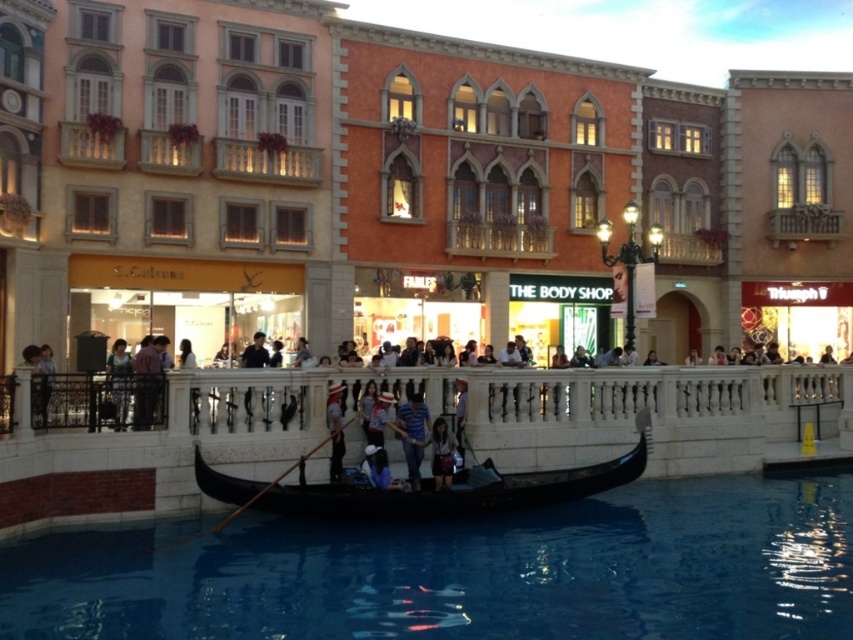
Question: Does matte orange building at center have a lesser width compared to blue striped shirt at center?

Choices:
 (A) yes
 (B) no

Answer: (B)

Question: Which object is closer to the camera taking this photo?

Choices:
 (A) blue striped shirt at center
 (B) matte orange building at center

Answer: (A)

Question: Among these objects, which one is farthest from the camera?

Choices:
 (A) transparent glass water at center
 (B) matte orange building at center

Answer: (B)

Question: Which of these objects is positioned closest to the matte orange building at center?

Choices:
 (A) black polished wood gondola at center
 (B) blue striped shirt at center

Answer: (B)

Question: Can you confirm if transparent glass water at center is positioned above wooden paddle at center?

Choices:
 (A) no
 (B) yes

Answer: (A)

Question: Does black polished wood gondola at center have a lesser width compared to denim jacket at center?

Choices:
 (A) no
 (B) yes

Answer: (A)